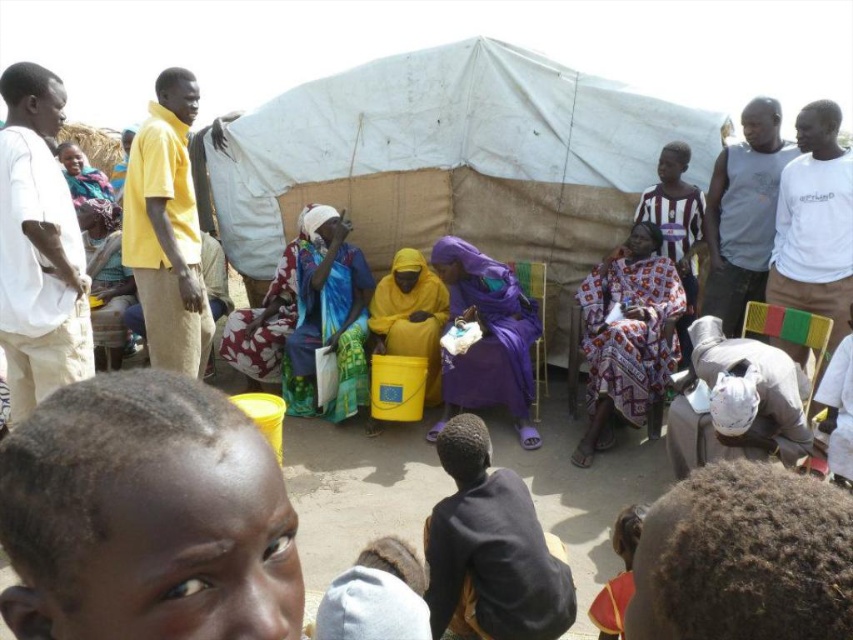
Does white canvas tent at center have a lesser width compared to printed fabric dress at center?

No, white canvas tent at center is not thinner than printed fabric dress at center.

Measure the distance between white canvas tent at center and camera.

white canvas tent at center and camera are 9.44 meters apart.

Locate an element on the screen. Image resolution: width=853 pixels, height=640 pixels. white canvas tent at center is located at coordinates (450, 157).

Can you confirm if white canvas tent at center is shorter than yellow fabric dress at center?

Incorrect, white canvas tent at center's height does not fall short of yellow fabric dress at center's.

Can you confirm if white canvas tent at center is thinner than yellow fabric dress at center?

In fact, white canvas tent at center might be wider than yellow fabric dress at center.

Identify the location of white canvas tent at center. The width and height of the screenshot is (853, 640). (450, 157).

Which is behind, point (624, 260) or point (386, 292)?

The point (386, 292) is behind.

Who is lower down, printed fabric dress at center or yellow matte plastic bucket at center?

Positioned lower is printed fabric dress at center.

The image size is (853, 640). I want to click on printed fabric dress at center, so click(628, 339).

Where is `printed fabric dress at center`? printed fabric dress at center is located at coordinates (628, 339).